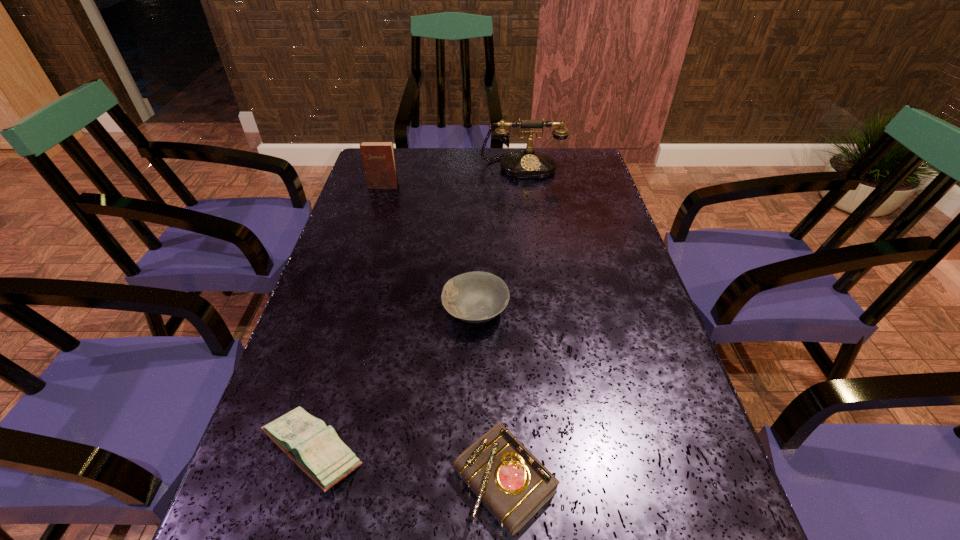
The height and width of the screenshot is (540, 960). I want to click on empty space that is in between the tallest diary and the telephone, so click(452, 176).

The width and height of the screenshot is (960, 540). I want to click on the closest object to the tallest diary, so click(x=529, y=164).

Identify which object is located as the nearest to the bowl. Please provide its 2D coordinates. Your answer should be formatted as a tuple, i.e. [(x, y)], where the tuple contains the x and y coordinates of a point satisfying the conditions above.

[(315, 448)]

This screenshot has height=540, width=960. Identify the location of diary object that ranks as the second closest to the farthest object. (315, 448).

The height and width of the screenshot is (540, 960). What are the coordinates of `the third closest diary to the telephone` in the screenshot? It's located at pos(506,477).